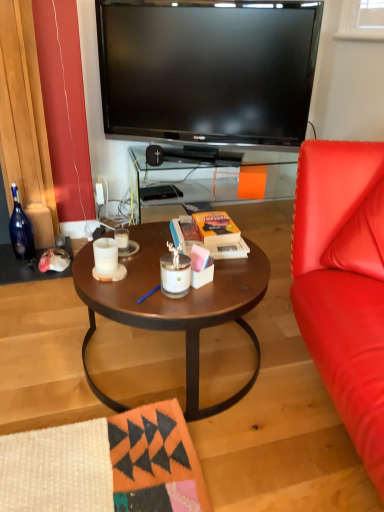
Identify the location of free spot behind white matte candle at center, the second coffee cup when ordered from front to back. The width and height of the screenshot is (384, 512). tap(140, 232).